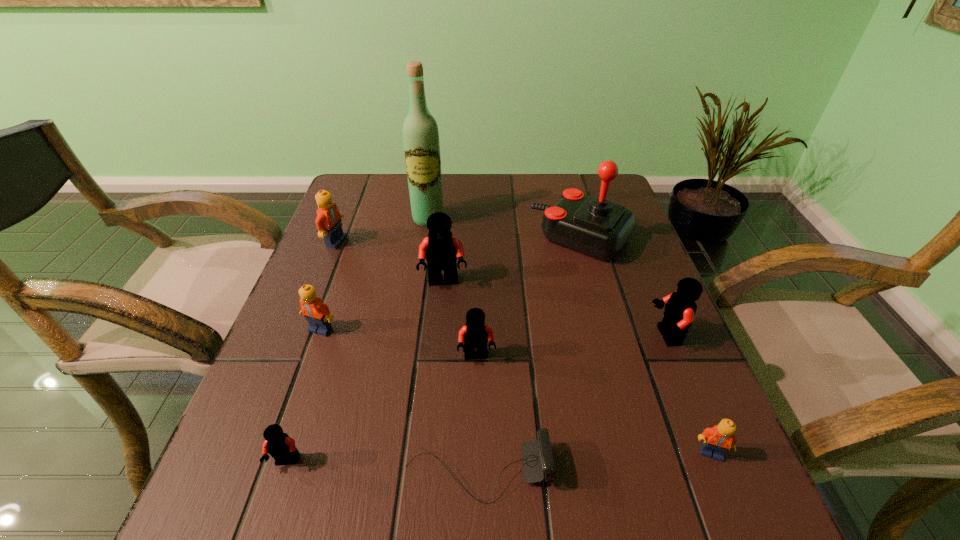
The height and width of the screenshot is (540, 960). What are the coordinates of `Lego that stands as the sixth closest to the wine bottle` in the screenshot? It's located at (281, 447).

The image size is (960, 540). In order to click on the closest black Lego to the second smallest black Lego in this screenshot , I will do `click(441, 249)`.

Locate an element on the screen. The width and height of the screenshot is (960, 540). black Lego that is the nearest to the second smallest black Lego is located at coordinates (441, 249).

The width and height of the screenshot is (960, 540). I want to click on orange Lego that can be found as the second closest to the farthest orange Lego, so click(718, 440).

I want to click on orange Lego that is the closest to the second smallest orange Lego, so click(x=328, y=221).

You are a GUI agent. You are given a task and a screenshot of the screen. Output one action in this format:
    pyautogui.click(x=<x>, y=<y>)
    Task: Click on the vacant region that satisfies the following two spatial constraints: 1. on the front-facing side of the white wine bottle; 2. on the right side of the ninth shortest object
    This screenshot has width=960, height=540.
    Given the screenshot: What is the action you would take?
    pyautogui.click(x=425, y=238)